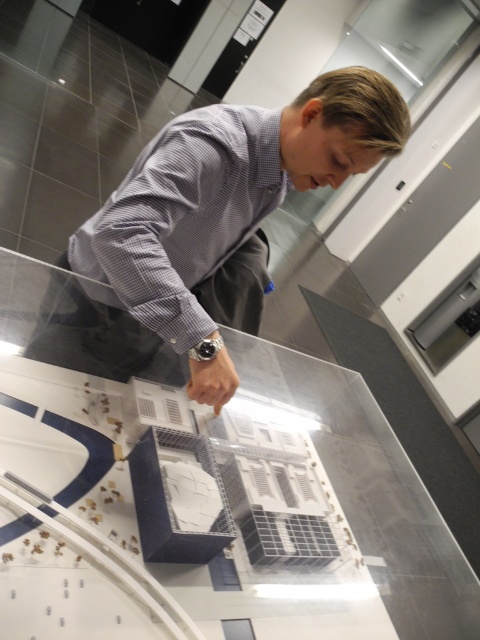
What are the coordinates of the transparent glass table at center?

The transparent glass table at center is located at point (222, 497).

You are a photographer trying to capture a clear image of the architectural model on the table. The gray checkered shirt at upper center and the gray checkered dress shirt at center are blocking your view. How far apart are these two shirts from each other?

The gray checkered shirt at upper center is 3.72 centimeters away from the gray checkered dress shirt at center, so they are 3.72 centimeters apart.